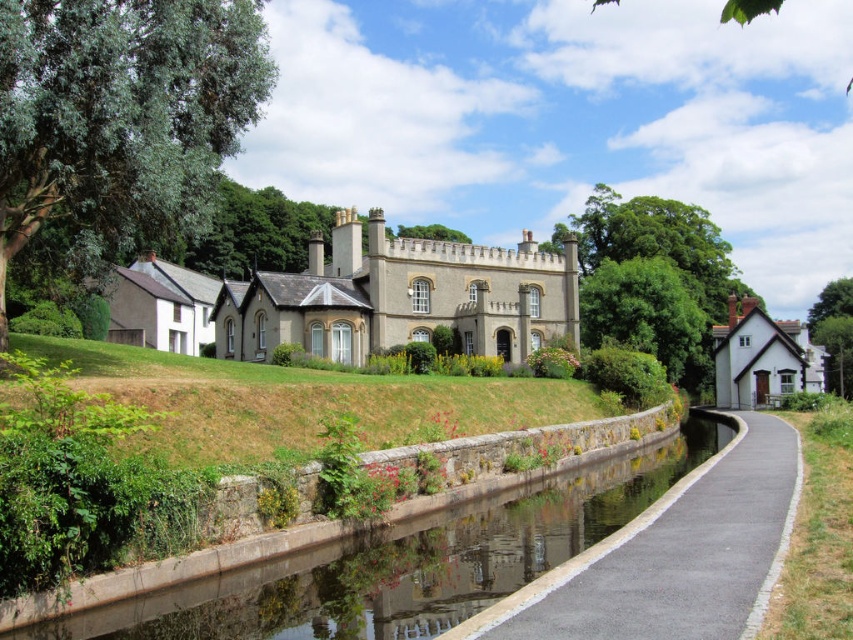
You are a cyclist planning to ride along the black asphalt path at center and the gray stone castle at center. Which of these two objects has a narrower width?

The black asphalt path at center is thinner than the gray stone castle at center, so the black asphalt path at center has a narrower width.